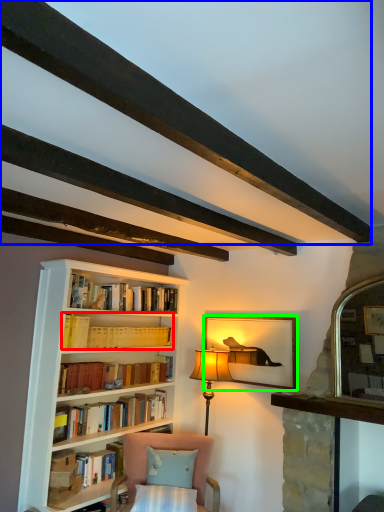
Question: Which object is the closest to the book (highlighted by a red box)? Choose among these: plank (highlighted by a blue box) or picture frame (highlighted by a green box).

Choices:
 (A) plank
 (B) picture frame

Answer: (B)